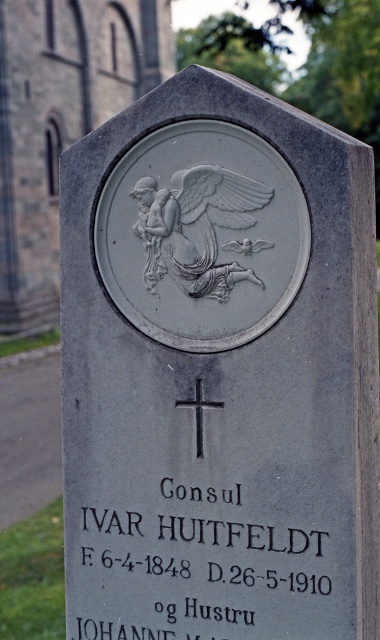
Measure the distance between matte gray angel at upper center and white glossy eagle at center.

A distance of 6.21 meters exists between matte gray angel at upper center and white glossy eagle at center.

Is matte gray angel at upper center taller than white glossy eagle at center?

Yes.

Who is more forward, (93, 120) or (182, 234)?

Point (182, 234)

I want to click on matte gray angel at upper center, so click(61, 122).

Does white glossy eagle at center have a lesser height compared to black metal cross at center?

Incorrect, white glossy eagle at center's height does not fall short of black metal cross at center's.

Image resolution: width=380 pixels, height=640 pixels. Find the location of `white glossy eagle at center`. white glossy eagle at center is located at coordinates (196, 227).

From the picture: Does black stone text at center come behind black metal cross at center?

No, black stone text at center is closer to the viewer.

Is point (87, 586) more distant than point (213, 404)?

Yes, point (87, 586) is behind point (213, 404).

Image resolution: width=380 pixels, height=640 pixels. I want to click on black stone text at center, so click(191, 568).